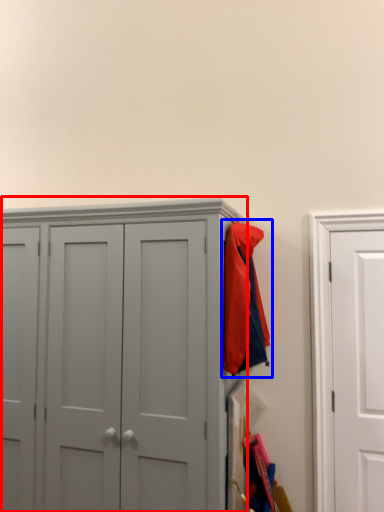
Question: Which of the following is the closest to the observer, cupboard (highlighted by a red box) or jacket (highlighted by a blue box)?

Choices:
 (A) cupboard
 (B) jacket

Answer: (A)